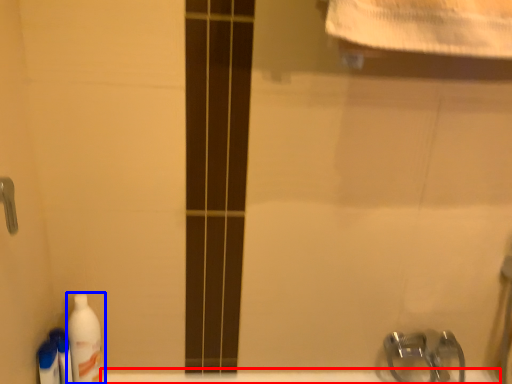
Question: Which object is further to the camera taking this photo, bath (highlighted by a red box) or cleaning product (highlighted by a blue box)?

Choices:
 (A) bath
 (B) cleaning product

Answer: (A)